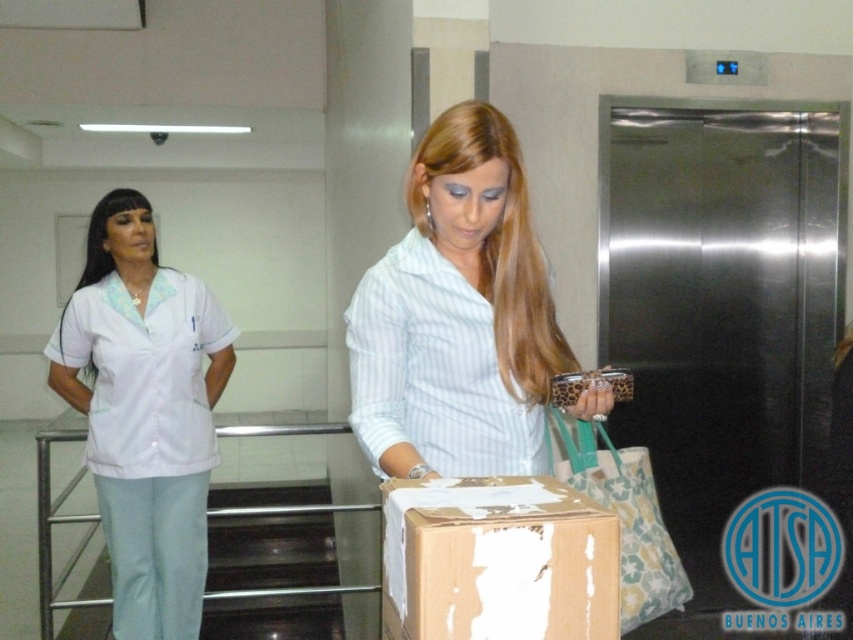
You are a nurse in a hospital. You see a light blue striped shirt at center and a patterned fabric shopping bag at center. Which item is larger?

The patterned fabric shopping bag at center is larger than the light blue striped shirt at center.

You are a nurse in this hospital scene. You need to determine which clothing item is shorter in height between the light blue striped shirt at center and the white fabric uniform at left. Which one is shorter?

A: The light blue striped shirt at center has a lesser height compared to the white fabric uniform at left, so the light blue striped shirt at center is shorter in height.

You are a nurse in a hospital who needs to deliver a medical kit to the nurse station. The white fabric uniform at left is yours, and the brown cardboard box at center is the medical kit. Can you safely carry the medical kit from your current position to the nurse station 2 meters away without dropping it?

The white fabric uniform at left is 1.76 meters away from the brown cardboard box at center. Since the distance between them is less than 2 meters, you can safely carry the medical kit from your current position to the nurse station without dropping it.